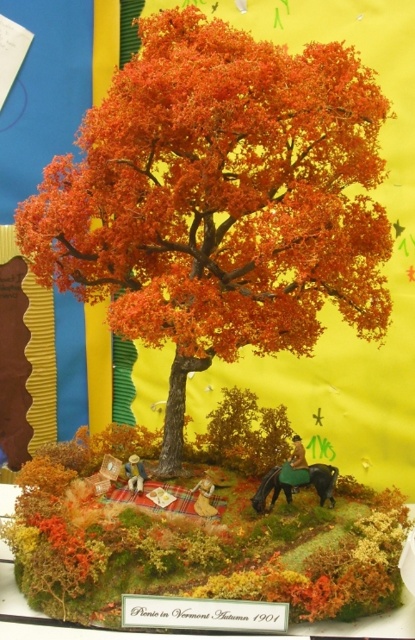
Between orange matte tree at center and green felt horse at center, which one appears on the right side from the viewer's perspective?

green felt horse at center

Who is more forward, (63, 272) or (292, 488)?

Point (292, 488) is in front.

The width and height of the screenshot is (415, 640). Identify the location of orange matte tree at center. (219, 198).